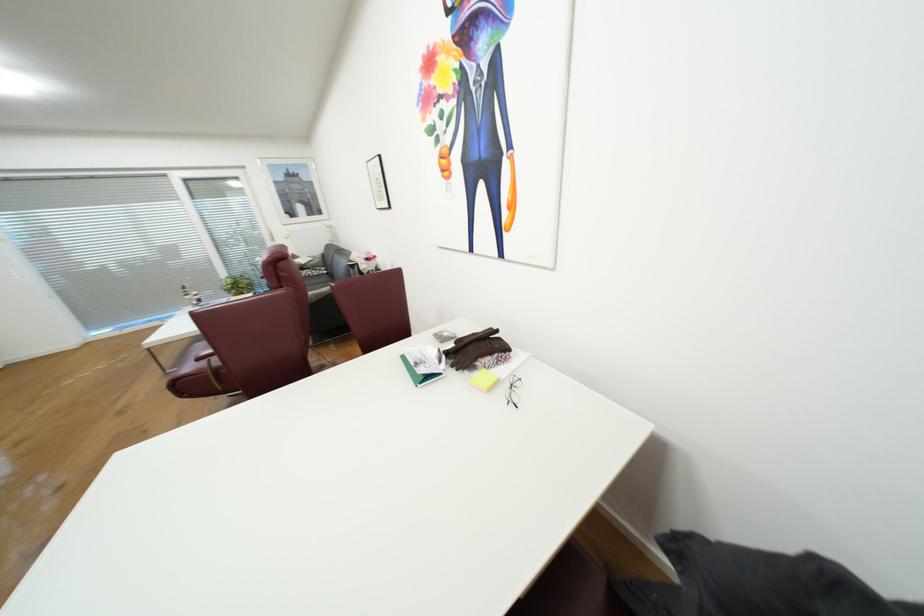
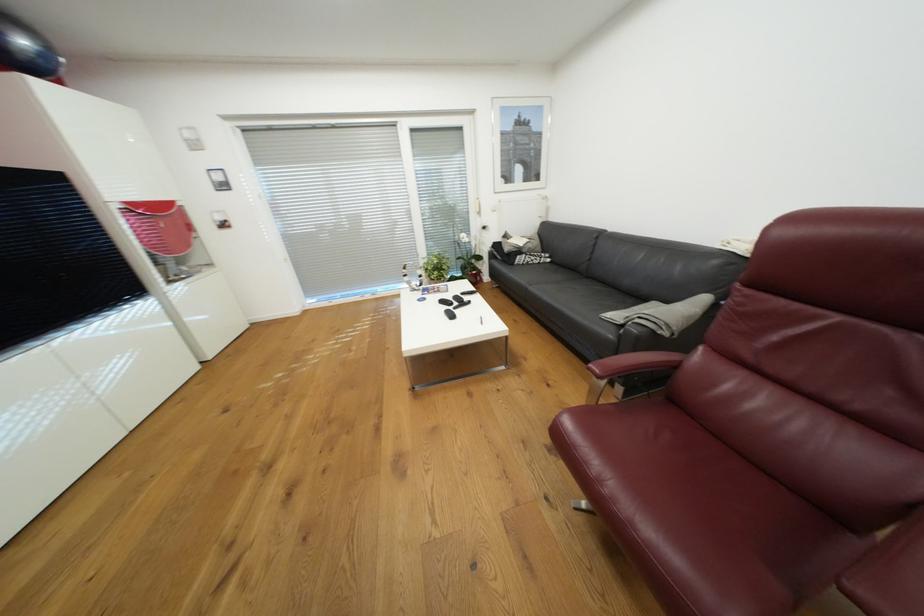
Find the pixel in the second image that matches point (207, 301) in the first image.

(427, 284)